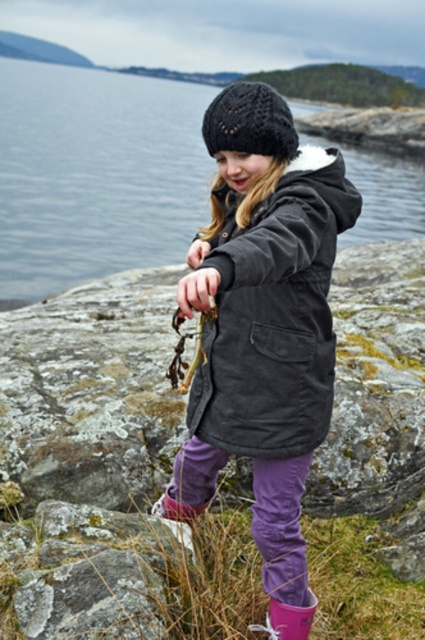
From the picture: You are a tailor measuring the distance between two items on a mannequin. The items are the dark gray corduroy jacket at center and the black knitted hat at center. The minimum space required between them for proper fitting is 20 inches. Can the current distance accommodate this requirement?

The dark gray corduroy jacket at center and the black knitted hat at center are 21.88 inches apart, which exceeds the minimum required 20 inches. Therefore, the current distance can accommodate the requirement.